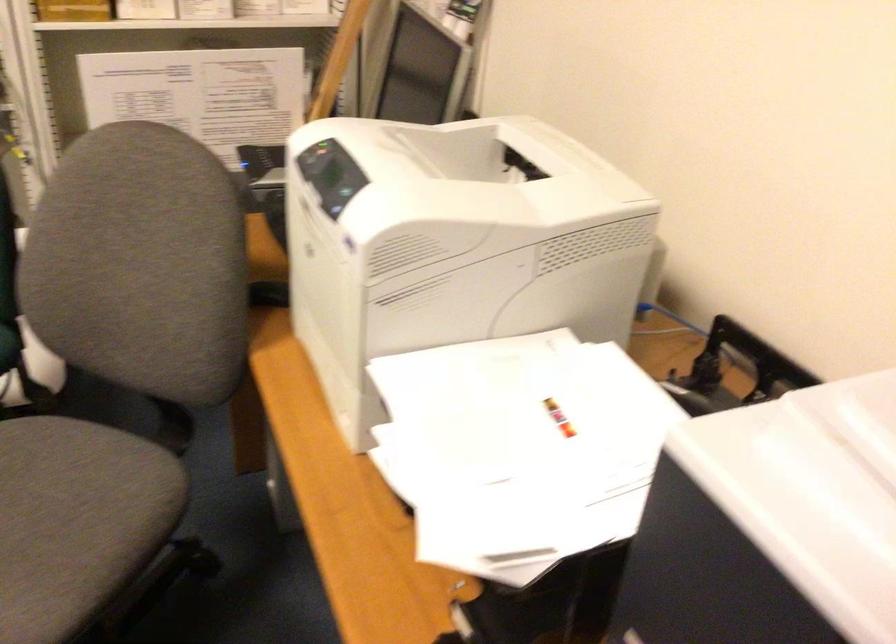
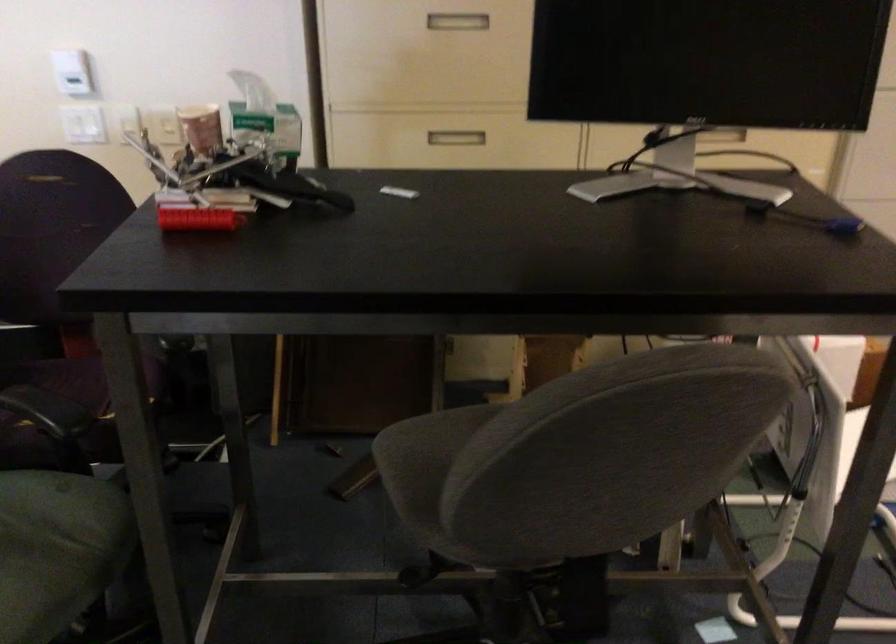
In a continuous first-person perspective shot, in which direction is the camera moving?

The cameraman moved toward left, backward.